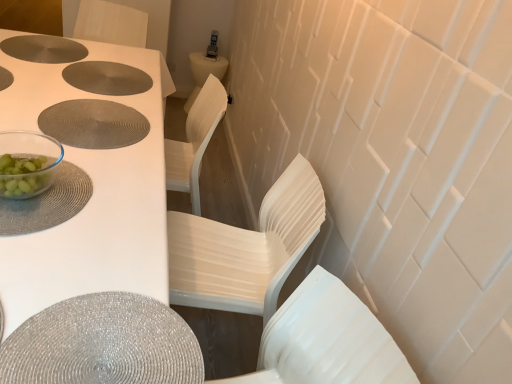
Where is `vacant space in front of matte silver placemat at center, which ranks as the first hole in bottom-to-top order`? vacant space in front of matte silver placemat at center, which ranks as the first hole in bottom-to-top order is located at coordinates (76, 162).